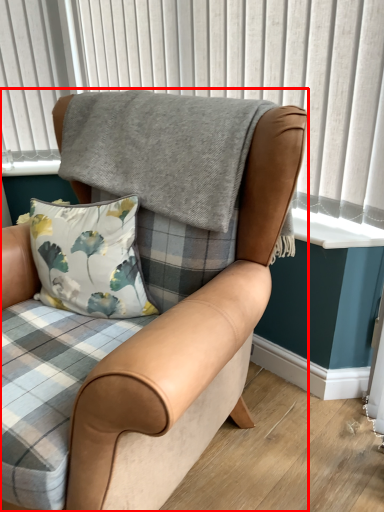
Question: Observing the image, what is the correct spatial positioning of chair (annotated by the red box) in reference to window frame?

Choices:
 (A) right
 (B) left

Answer: (B)